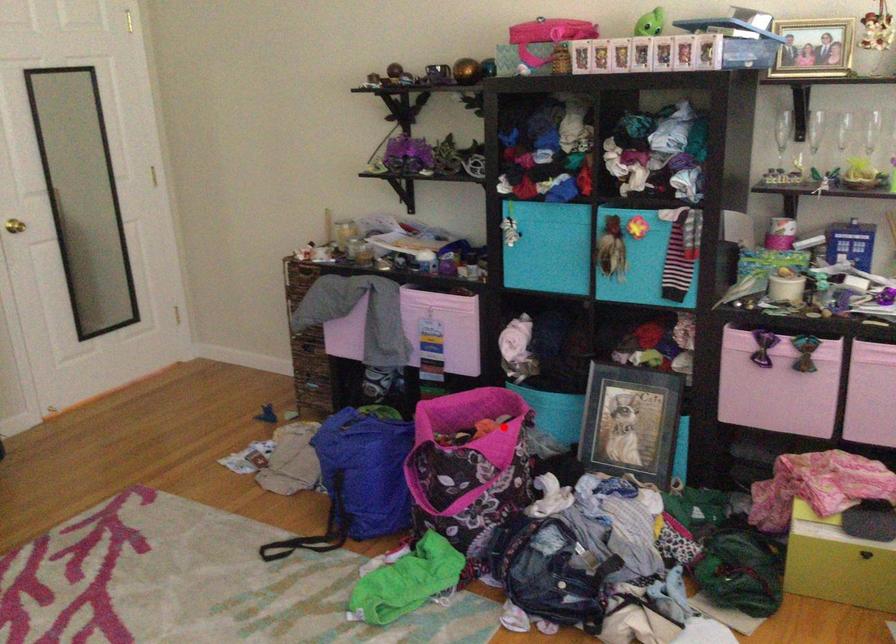
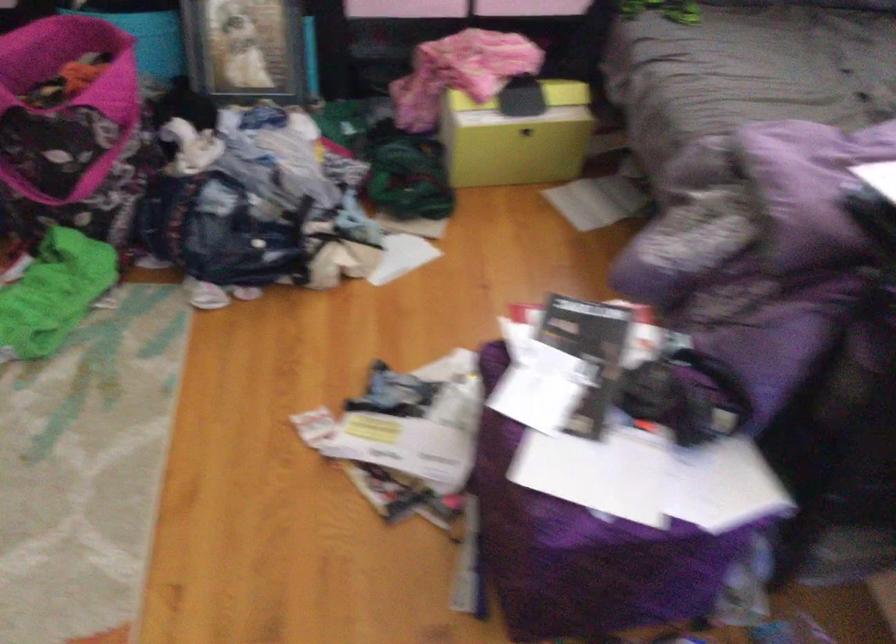
Find the pixel in the second image that matches the highlighted location in the first image.

(124, 67)